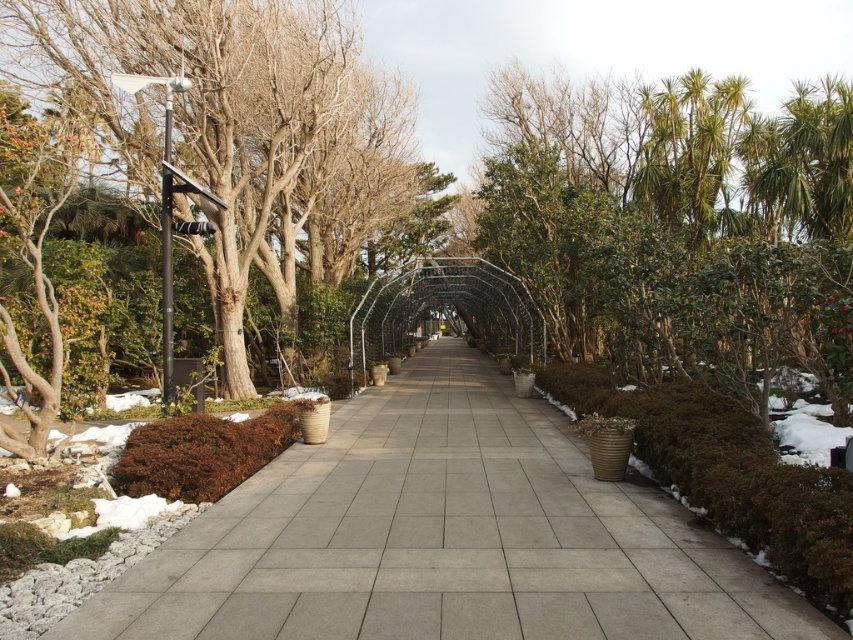
Question: Which object is farther from the camera taking this photo?

Choices:
 (A) dark green textured bush at right
 (B) brown bark tree at left
 (C) gray concrete pavement at center
 (D) green leafy tree at center

Answer: (B)

Question: Is gray concrete pavement at center to the right of brown bark tree at left from the viewer's perspective?

Choices:
 (A) no
 (B) yes

Answer: (B)

Question: Which point is farther from the camera taking this photo?

Choices:
 (A) (543, 266)
 (B) (734, 627)

Answer: (A)

Question: Does gray concrete pavement at center appear under dark green textured bush at right?

Choices:
 (A) no
 (B) yes

Answer: (B)

Question: Which of these objects is positioned farthest from the green leafy tree at center?

Choices:
 (A) dark green textured bush at right
 (B) gray concrete pavement at center
 (C) brown matte bush at lower left
 (D) brown bark tree at left

Answer: (C)

Question: Is green leafy tree at center bigger than dark green textured bush at right?

Choices:
 (A) yes
 (B) no

Answer: (A)